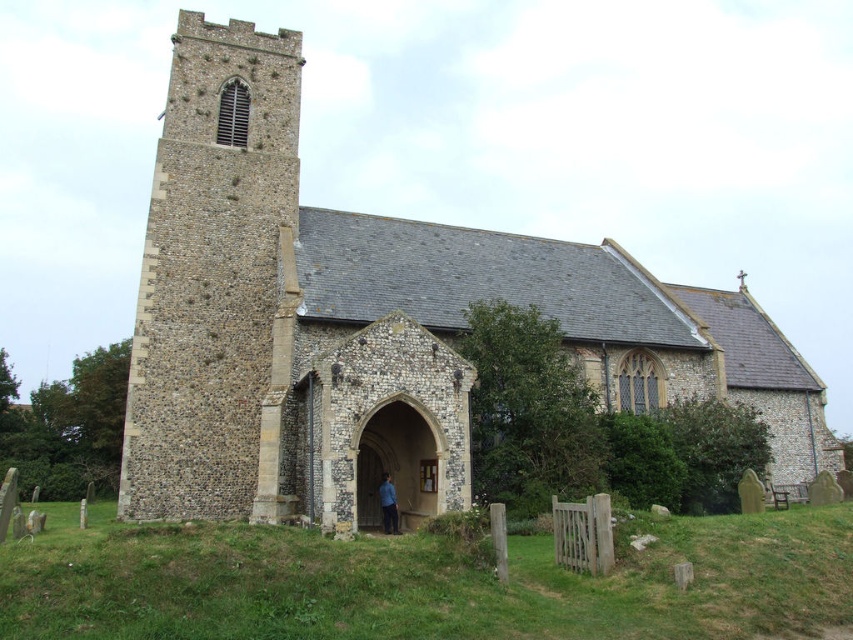
You are standing at the point marked as point (372, 321) in the image. What structure are you currently standing on?

You are standing on the stone church at center, as point (372, 321) is located on it.

You are standing in front of the stone church at center and the blue fabric at center. Which object is closer to the left side of the scene?

The blue fabric at center is closer to the left side of the scene because the stone church at center is to its right.

From the picture: You are a visitor standing in front of the stone church at center. You notice a blue fabric at center nearby. Which object occupies more space in the image?

The stone church at center is larger in size than the blue fabric at center, so it occupies more space in the image.